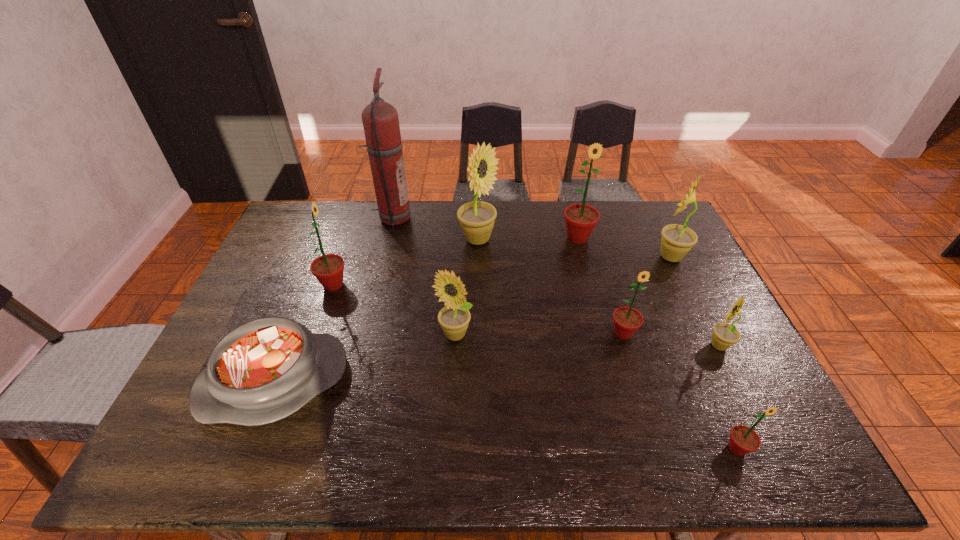
Find the location of a particular element. This screenshot has width=960, height=540. vacant space located on the face of the fifth nearest sunflower is located at coordinates (418, 285).

You are a GUI agent. You are given a task and a screenshot of the screen. Output one action in this format:
    pyautogui.click(x=<x>, y=<y>)
    Task: Click on the free space located on the face of the second smallest green sunflower
    
    Given the screenshot: What is the action you would take?
    pyautogui.click(x=660, y=453)

In order to click on free space located on the face of the third biggest yellow sunflower in this screenshot , I will do `click(448, 458)`.

Locate an element on the screen. free location located 0.180m on the face of the smallest yellow sunflower is located at coordinates (639, 346).

Locate an element on the screen. The width and height of the screenshot is (960, 540). vacant area situated on the face of the smallest yellow sunflower is located at coordinates (632, 346).

Find the location of `blank area located on the face of the smallest yellow sunflower`. blank area located on the face of the smallest yellow sunflower is located at coordinates (587, 346).

Locate an element on the screen. vacant space located 0.380m on the right of the gray casserole is located at coordinates (498, 381).

Identify the location of fire extinguisher at the far edge. The height and width of the screenshot is (540, 960). (380, 119).

You are a GUI agent. You are given a task and a screenshot of the screen. Output one action in this format:
    pyautogui.click(x=<x>, y=<y>)
    Task: Click on the sunflower that is at the near edge
    The height and width of the screenshot is (540, 960).
    Given the screenshot: What is the action you would take?
    pyautogui.click(x=743, y=439)

Image resolution: width=960 pixels, height=540 pixels. What are the coordinates of `casserole that is positioned at the near edge` in the screenshot? It's located at (264, 370).